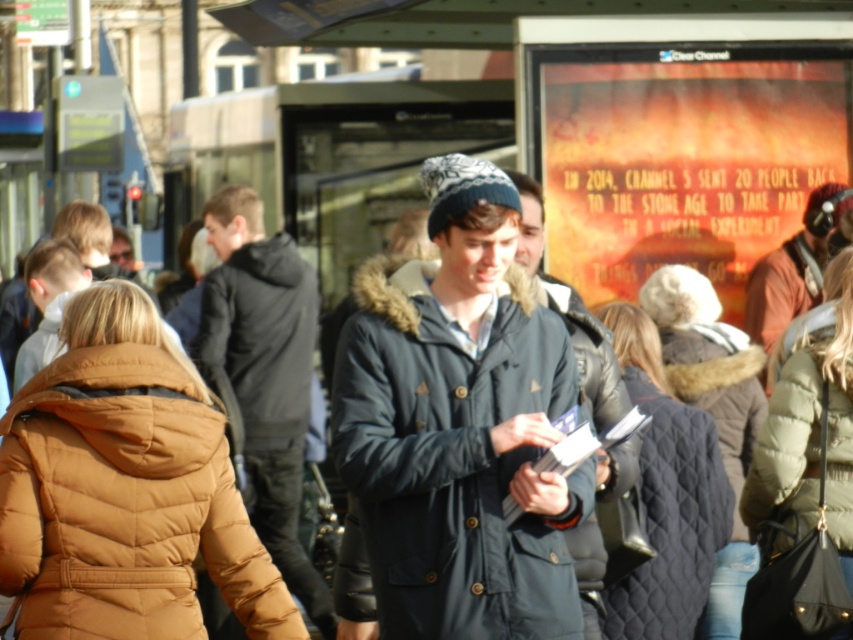
Question: Does navy blue quilted jacket at center have a larger size compared to green quilted jacket at lower right?

Choices:
 (A) no
 (B) yes

Answer: (A)

Question: Can you confirm if navy blue quilted jacket at center is wider than brown quilted coat at center?

Choices:
 (A) no
 (B) yes

Answer: (A)

Question: Among these objects, which one is nearest to the camera?

Choices:
 (A) dark blue jacket at center
 (B) brown quilted jacket at lower left

Answer: (B)

Question: Which object is positioned farthest from the black quilted jacket at center?

Choices:
 (A) navy blue quilted jacket at center
 (B) dark blue jacket at center
 (C) dark blue quilted jacket at center
 (D) brown quilted jacket at lower left

Answer: (D)

Question: Considering the real-world distances, which object is farthest from the brown quilted coat at center?

Choices:
 (A) dark blue quilted jacket at center
 (B) quilted black jacket at center

Answer: (A)

Question: Does dark blue quilted jacket at center appear on the right side of brown quilted coat at center?

Choices:
 (A) no
 (B) yes

Answer: (A)